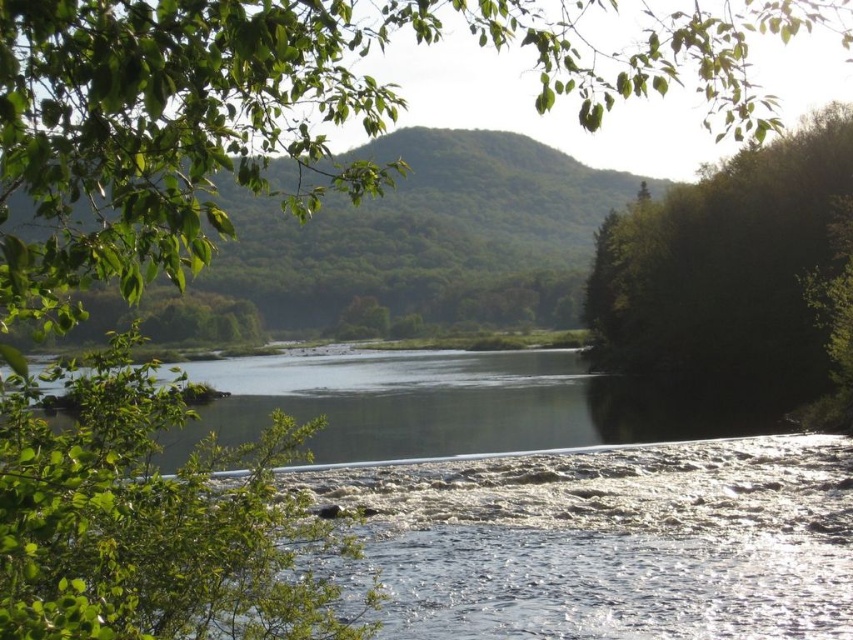
You are a hiker standing at the riverbank and want to take a photo of both the green leafy tree at upper left and the green leafy tree at right. Which tree should you position closer to the camera to include both in the frame?

You should position the green leafy tree at upper left closer to the camera because it is positioned over the green leafy tree at right, meaning it is farther away and needs to be brought into the frame by adjusting your position.

You are standing at the center of the river and want to reach the green leafy tree at upper left and the green leafy tree at right. Which tree is closer to your left side?

The green leafy tree at upper left is to the left of the green leafy tree at right, so the green leafy tree at upper left is closer to your left side.